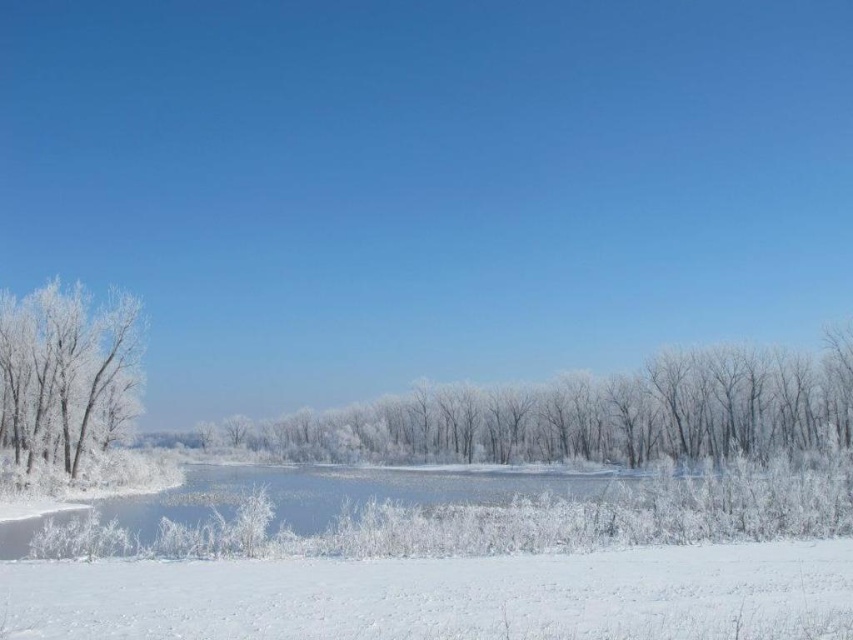
Question: Does white fluffy snow at lower center appear on the left side of white frosty trees at center?

Choices:
 (A) no
 (B) yes

Answer: (B)

Question: Which object is closer to the camera taking this photo?

Choices:
 (A) white frosty trees at center
 (B) white fluffy snow at lower center
 (C) frosted glass tree at left

Answer: (B)

Question: Does white fluffy snow at lower center appear on the right side of white frosty trees at center?

Choices:
 (A) yes
 (B) no

Answer: (B)

Question: Estimate the real-world distances between objects in this image. Which object is closer to the frosted glass tree at left?

Choices:
 (A) white frosty trees at center
 (B) white fluffy snow at lower center

Answer: (B)

Question: Which point is closer to the camera?

Choices:
 (A) (788, 589)
 (B) (49, 339)
 (C) (730, 406)

Answer: (A)

Question: Does white frosty trees at center come in front of frosted glass tree at left?

Choices:
 (A) no
 (B) yes

Answer: (A)